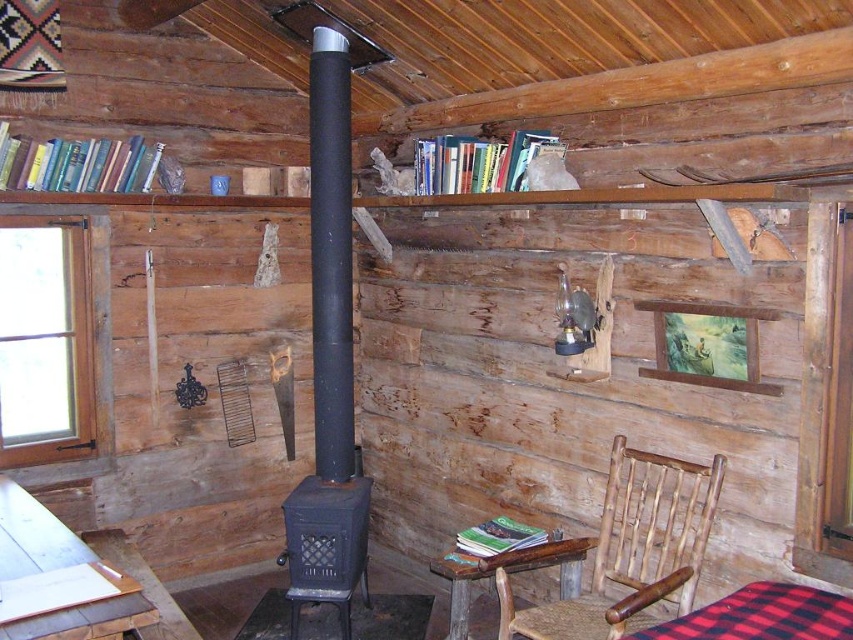
Question: Does woven wood chair at lower right have a smaller size compared to rustic wood table at lower center?

Choices:
 (A) no
 (B) yes

Answer: (A)

Question: Estimate the real-world distances between objects in this image. Which object is closer to the rustic wood table at lower center?

Choices:
 (A) red plaid fabric at lower right
 (B) woven wood chair at lower right

Answer: (B)

Question: Can you confirm if red plaid fabric at lower right is bigger than rustic wood table at lower center?

Choices:
 (A) no
 (B) yes

Answer: (A)

Question: Which of the following is the farthest from the observer?

Choices:
 (A) (740, 593)
 (B) (612, 448)

Answer: (B)

Question: Does red plaid fabric at lower right appear on the right side of rustic wood table at lower center?

Choices:
 (A) yes
 (B) no

Answer: (A)

Question: Among these objects, which one is nearest to the camera?

Choices:
 (A) rustic wood table at lower center
 (B) red plaid fabric at lower right

Answer: (B)